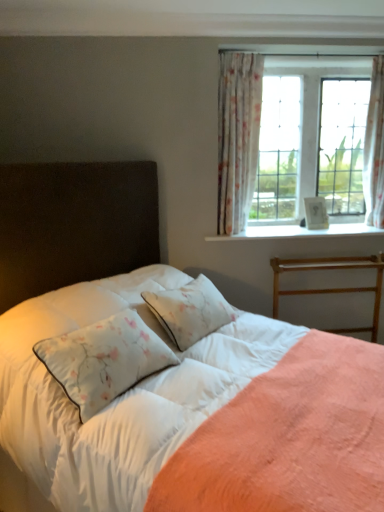
Question: Is white textured wood at upper right thinner than floral sheer curtain at upper right, marked as the 2th curtain in a right-to-left arrangement?

Choices:
 (A) yes
 (B) no

Answer: (B)

Question: From a real-world perspective, does white textured wood at upper right sit lower than floral sheer curtain at upper right, marked as the 2th curtain in a right-to-left arrangement?

Choices:
 (A) yes
 (B) no

Answer: (A)

Question: Is the position of white textured wood at upper right more distant than that of floral sheer curtain at upper right, marked as the 2th curtain in a right-to-left arrangement?

Choices:
 (A) yes
 (B) no

Answer: (A)

Question: Does white textured wood at upper right turn towards floral sheer curtain at upper right, which appears as the first curtain when viewed from the left?

Choices:
 (A) yes
 (B) no

Answer: (B)

Question: Is white textured wood at upper right turned away from floral sheer curtain at upper right, which appears as the first curtain when viewed from the left?

Choices:
 (A) yes
 (B) no

Answer: (B)

Question: Do you think floral sheer curtain at upper right, marked as the 2th curtain in a right-to-left arrangement, is within white textured wood at upper right, or outside of it?

Choices:
 (A) outside
 (B) inside

Answer: (A)

Question: Considering the positions of floral sheer curtain at upper right, marked as the 2th curtain in a right-to-left arrangement, and white textured wood at upper right in the image, is floral sheer curtain at upper right, marked as the 2th curtain in a right-to-left arrangement, wider or thinner than white textured wood at upper right?

Choices:
 (A) wide
 (B) thin

Answer: (B)

Question: Relative to white textured wood at upper right, is floral sheer curtain at upper right, which appears as the first curtain when viewed from the left, in front or behind?

Choices:
 (A) front
 (B) behind

Answer: (A)

Question: From the image's perspective, is floral sheer curtain at upper right, which appears as the first curtain when viewed from the left, positioned above or below white textured wood at upper right?

Choices:
 (A) below
 (B) above

Answer: (B)

Question: Is point (362, 263) positioned closer to the camera than point (96, 470)?

Choices:
 (A) closer
 (B) farther

Answer: (B)

Question: In terms of height, does wooden bed frame at right look taller or shorter compared to white satin sheet at center?

Choices:
 (A) short
 (B) tall

Answer: (A)

Question: Looking at their shapes, would you say wooden bed frame at right is wider or thinner than white satin sheet at center?

Choices:
 (A) thin
 (B) wide

Answer: (A)

Question: Is wooden bed frame at right in front of or behind white satin sheet at center in the image?

Choices:
 (A) behind
 (B) front

Answer: (A)

Question: Relative to floral sheer curtain at upper right, which appears as the first curtain when viewed from the left, is white textured wood at upper right in front or behind?

Choices:
 (A) behind
 (B) front

Answer: (A)

Question: From the image's perspective, relative to floral sheer curtain at upper right, marked as the 2th curtain in a right-to-left arrangement, is white textured wood at upper right above or below?

Choices:
 (A) below
 (B) above

Answer: (A)